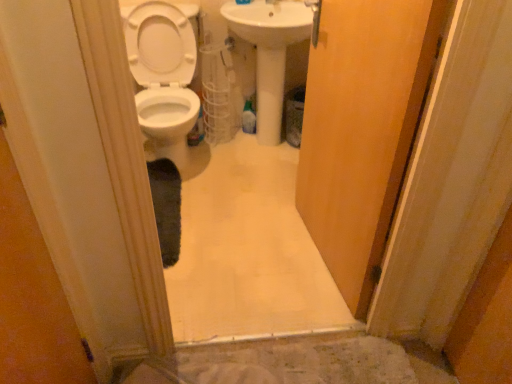
Question: From the image's perspective, is wooden door at center above white glossy sink at center?

Choices:
 (A) no
 (B) yes

Answer: (A)

Question: Is wooden door at center wider than white glossy sink at center?

Choices:
 (A) yes
 (B) no

Answer: (B)

Question: From the image's perspective, is wooden door at center beneath white glossy sink at center?

Choices:
 (A) yes
 (B) no

Answer: (A)

Question: Considering the relative sizes of wooden door at center and white glossy sink at center in the image provided, is wooden door at center smaller than white glossy sink at center?

Choices:
 (A) yes
 (B) no

Answer: (A)

Question: From a real-world perspective, is wooden door at center physically below white glossy sink at center?

Choices:
 (A) no
 (B) yes

Answer: (A)

Question: Is wooden door at center taller or shorter than white glossy toilet at left?

Choices:
 (A) tall
 (B) short

Answer: (A)

Question: Choose the correct answer: Is wooden door at center inside white glossy toilet at left or outside it?

Choices:
 (A) outside
 (B) inside

Answer: (A)

Question: Considering the positions of wooden door at center and white glossy toilet at left in the image, is wooden door at center wider or thinner than white glossy toilet at left?

Choices:
 (A) thin
 (B) wide

Answer: (A)

Question: Considering the positions of point (325, 46) and point (160, 89), is point (325, 46) closer or farther from the camera than point (160, 89)?

Choices:
 (A) farther
 (B) closer

Answer: (B)

Question: Considering the positions of point (261, 56) and point (186, 38), is point (261, 56) closer or farther from the camera than point (186, 38)?

Choices:
 (A) closer
 (B) farther

Answer: (B)

Question: Considering the positions of white glossy sink at center and white glossy toilet at left in the image, is white glossy sink at center taller or shorter than white glossy toilet at left?

Choices:
 (A) short
 (B) tall

Answer: (B)

Question: Would you say white glossy sink at center is inside or outside white glossy toilet at left?

Choices:
 (A) outside
 (B) inside

Answer: (A)

Question: From the image's perspective, is white glossy sink at center above or below white glossy toilet at left?

Choices:
 (A) below
 (B) above

Answer: (B)

Question: Is white glossy toilet at left taller or shorter than white glossy sink at center?

Choices:
 (A) tall
 (B) short

Answer: (B)

Question: In terms of width, does white glossy toilet at left look wider or thinner when compared to white glossy sink at center?

Choices:
 (A) wide
 (B) thin

Answer: (A)